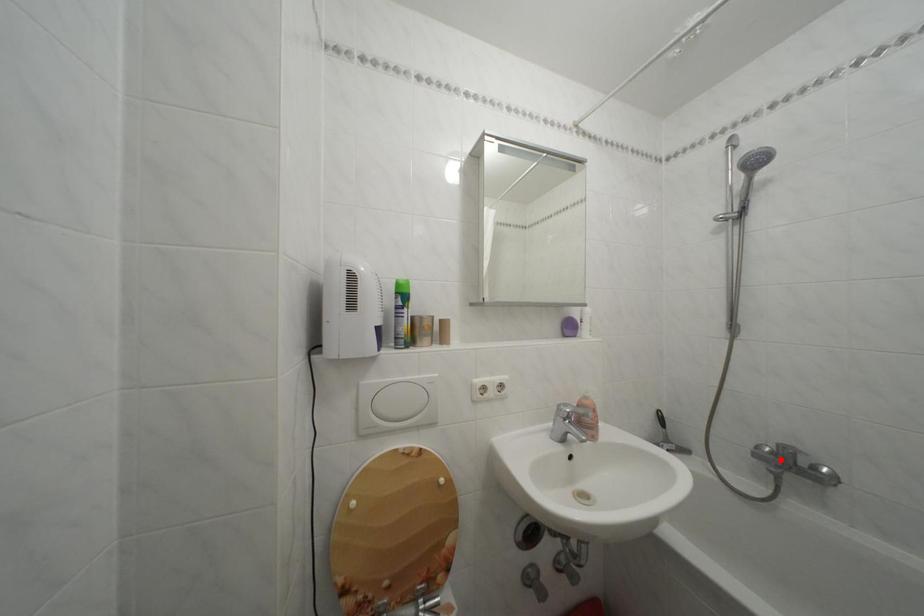
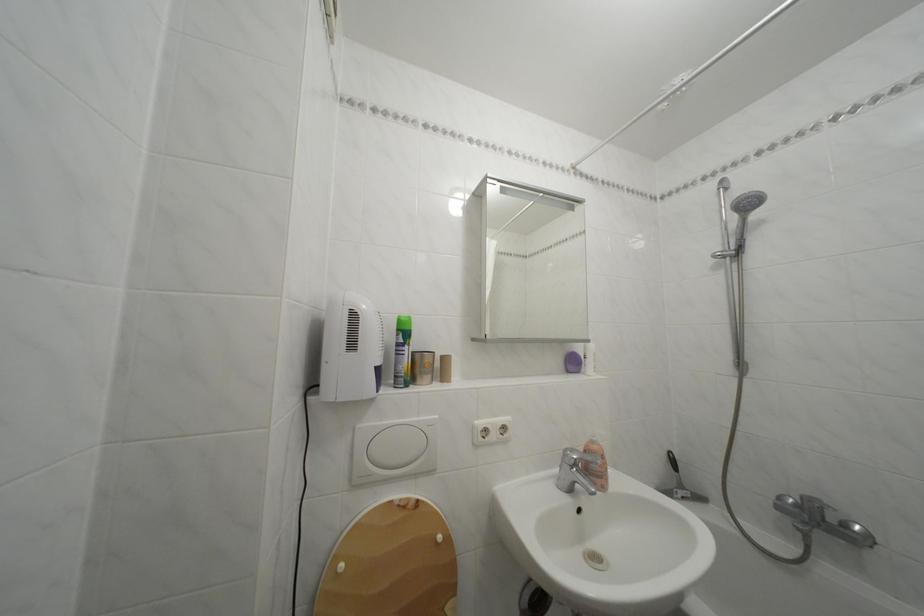
Find the pixel in the second image that matches the highlighted location in the first image.

(806, 512)